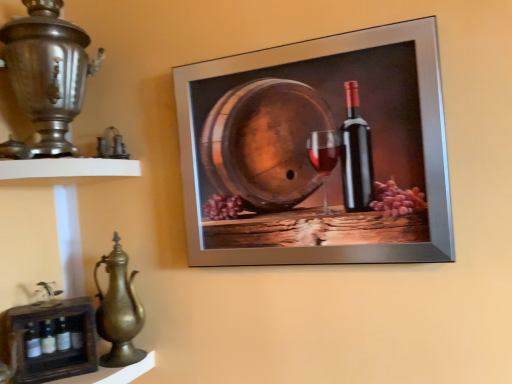
Question: Can you confirm if wooden crate at lower left, which appears as the 1th shelf when ordered from the bottom, is shorter than metallic silver frame at upper center?

Choices:
 (A) yes
 (B) no

Answer: (A)

Question: Could you tell me if wooden crate at lower left, arranged as the second shelf when viewed from the top, is turned towards metallic silver frame at upper center?

Choices:
 (A) yes
 (B) no

Answer: (B)

Question: Considering the relative positions of wooden crate at lower left, which appears as the 1th shelf when ordered from the bottom, and metallic silver frame at upper center in the image provided, is wooden crate at lower left, which appears as the 1th shelf when ordered from the bottom, to the left of metallic silver frame at upper center from the viewer's perspective?

Choices:
 (A) no
 (B) yes

Answer: (B)

Question: Is wooden crate at lower left, arranged as the second shelf when viewed from the top, next to metallic silver frame at upper center?

Choices:
 (A) yes
 (B) no

Answer: (B)

Question: Is wooden crate at lower left, arranged as the second shelf when viewed from the top, at the right side of metallic silver frame at upper center?

Choices:
 (A) yes
 (B) no

Answer: (B)

Question: Considering the positions of polished silver samovar at left and wooden crate at lower left, which appears as the 1th shelf when ordered from the bottom, in the image, is polished silver samovar at left taller or shorter than wooden crate at lower left, which appears as the 1th shelf when ordered from the bottom,?

Choices:
 (A) short
 (B) tall

Answer: (B)

Question: Considering the positions of point (37, 64) and point (15, 382), is point (37, 64) closer or farther from the camera than point (15, 382)?

Choices:
 (A) closer
 (B) farther

Answer: (A)

Question: Which is correct: polished silver samovar at left is inside wooden crate at lower left, which appears as the 1th shelf when ordered from the bottom, or outside of it?

Choices:
 (A) outside
 (B) inside

Answer: (A)

Question: From a real-world perspective, is polished silver samovar at left above or below wooden crate at lower left, which appears as the 1th shelf when ordered from the bottom?

Choices:
 (A) above
 (B) below

Answer: (A)

Question: From the image's perspective, relative to polished brass jug at lower left, is polished silver samovar at left above or below?

Choices:
 (A) below
 (B) above

Answer: (B)

Question: Is polished silver samovar at left inside the boundaries of polished brass jug at lower left, or outside?

Choices:
 (A) inside
 (B) outside

Answer: (B)

Question: From a real-world perspective, is polished silver samovar at left physically located above or below polished brass jug at lower left?

Choices:
 (A) above
 (B) below

Answer: (A)

Question: Considering the relative positions of polished silver samovar at left and polished brass jug at lower left in the image provided, is polished silver samovar at left to the left or to the right of polished brass jug at lower left?

Choices:
 (A) left
 (B) right

Answer: (A)

Question: Looking at their shapes, would you say white matte shelf at left, the second shelf positioned from the bottom, is wider or thinner than metallic silver frame at upper center?

Choices:
 (A) wide
 (B) thin

Answer: (A)

Question: From the image's perspective, is white matte shelf at left, the second shelf positioned from the bottom, positioned above or below metallic silver frame at upper center?

Choices:
 (A) above
 (B) below

Answer: (B)